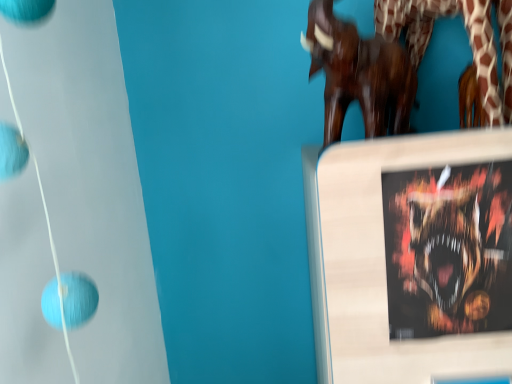
Question: Considering the positions of wooden sculpture at upper right and shiny metallic poster at upper right in the image, is wooden sculpture at upper right bigger or smaller than shiny metallic poster at upper right?

Choices:
 (A) small
 (B) big

Answer: (B)

Question: Considering the relative positions of wooden sculpture at upper right and shiny metallic poster at upper right in the image provided, is wooden sculpture at upper right to the left or to the right of shiny metallic poster at upper right?

Choices:
 (A) left
 (B) right

Answer: (A)

Question: From the image's perspective, is wooden sculpture at upper right located above or below shiny metallic poster at upper right?

Choices:
 (A) below
 (B) above

Answer: (B)

Question: In terms of height, does shiny metallic poster at upper right look taller or shorter compared to wooden sculpture at upper right?

Choices:
 (A) short
 (B) tall

Answer: (B)

Question: From a real-world perspective, is shiny metallic poster at upper right positioned above or below wooden sculpture at upper right?

Choices:
 (A) above
 (B) below

Answer: (B)

Question: Considering the relative positions of shiny metallic poster at upper right and wooden sculpture at upper right in the image provided, is shiny metallic poster at upper right to the left or to the right of wooden sculpture at upper right?

Choices:
 (A) right
 (B) left

Answer: (A)

Question: From the image's perspective, relative to wooden sculpture at upper right, is shiny metallic poster at upper right above or below?

Choices:
 (A) below
 (B) above

Answer: (A)